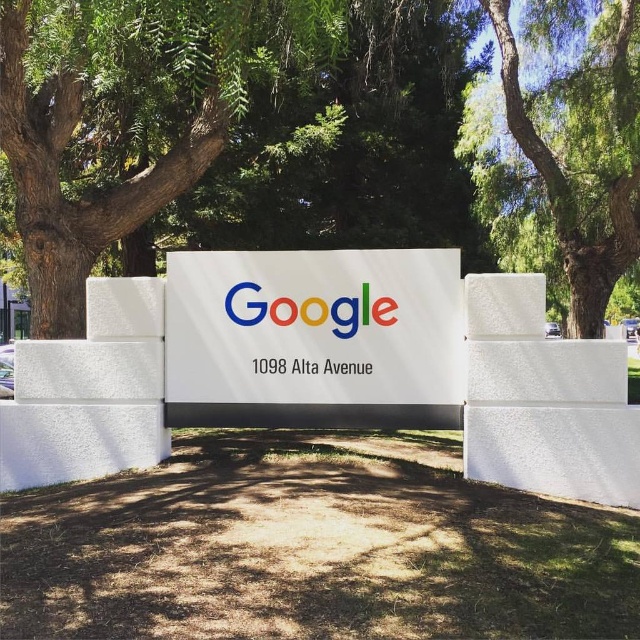
You are a photographer trying to capture the multicolored plastic google sign at center without any obstruction. However, there is a green leafy tree at upper center in the way. Based on their heights, can you suggest a position to stand so that the tree doesn

The green leafy tree at upper center is taller than the multicolored plastic google sign at center. To avoid the tree obstructing the view, you should position yourself lower so that the tree

You are standing in front of the Google signboard and want to take a photo. If your camera has a maximum focus range of 7 meters, will it be able to focus on the white glossy sign at center?

The white glossy sign at center is 7.58 meters away from the viewer. Since the camera can only focus up to 7 meters, it will not be able to focus on the sign.